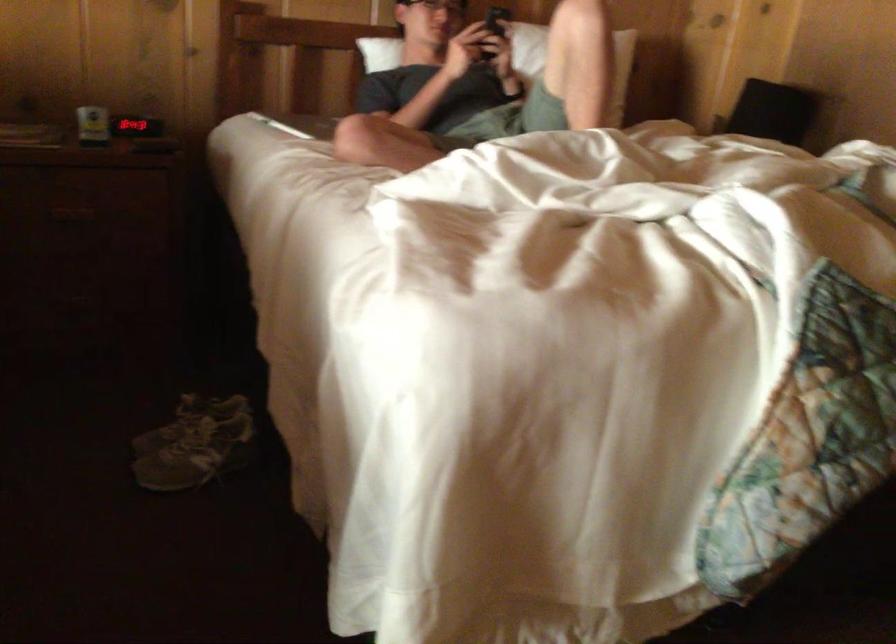
The location [135,126] corresponds to which object?

This point indicates the digital alarm clock.